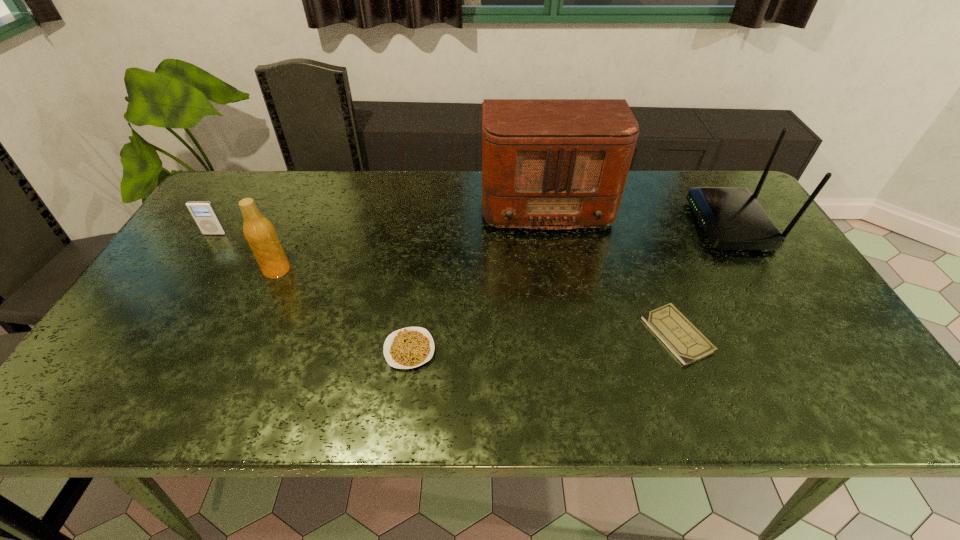
Where is `free spot between the shortest object and the router`? free spot between the shortest object and the router is located at coordinates 704,280.

I want to click on vacant region between the shortest object and the second shortest object, so click(x=543, y=342).

Find the location of a particular element. The image size is (960, 540). free space between the fourth object from right to left and the router is located at coordinates (570, 287).

Where is `unoccupied position between the shortest object and the radio receiver`? unoccupied position between the shortest object and the radio receiver is located at coordinates (611, 268).

Locate an element on the screen. free space between the fifth tallest object and the checkbook is located at coordinates (543, 342).

Where is `unoccupied area between the router and the fifth object from right to left`? The height and width of the screenshot is (540, 960). unoccupied area between the router and the fifth object from right to left is located at coordinates (504, 247).

Image resolution: width=960 pixels, height=540 pixels. I want to click on object that is the fifth closest one to the fourth tallest object, so click(732, 219).

Locate which object is the closest to the rightmost object. Please provide its 2D coordinates. Your answer should be formatted as a tuple, i.e. [(x, y)], where the tuple contains the x and y coordinates of a point satisfying the conditions above.

[(681, 337)]

Identify the location of vacant space that satisfies the following two spatial constraints: 1. on the front-facing side of the rightmost object; 2. on the front side of the checkbook. The height and width of the screenshot is (540, 960). (799, 334).